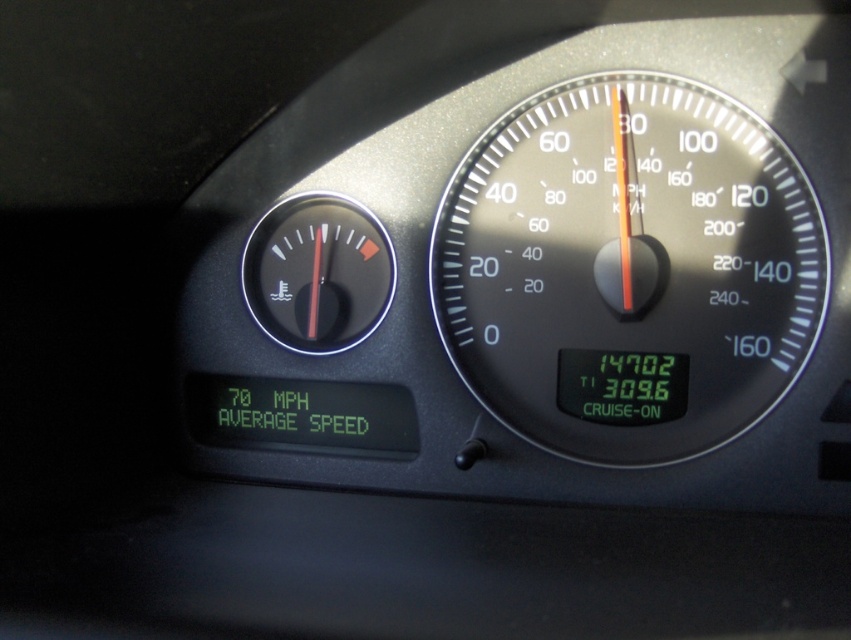
You are a driver checking your car instruments. You notice two black plastic gauges at center. Which one is closer to you, the black plastic speedometer at center or the black plastic gauge at center?

The black plastic speedometer at center is closer to you because it is in front of the black plastic gauge at center.